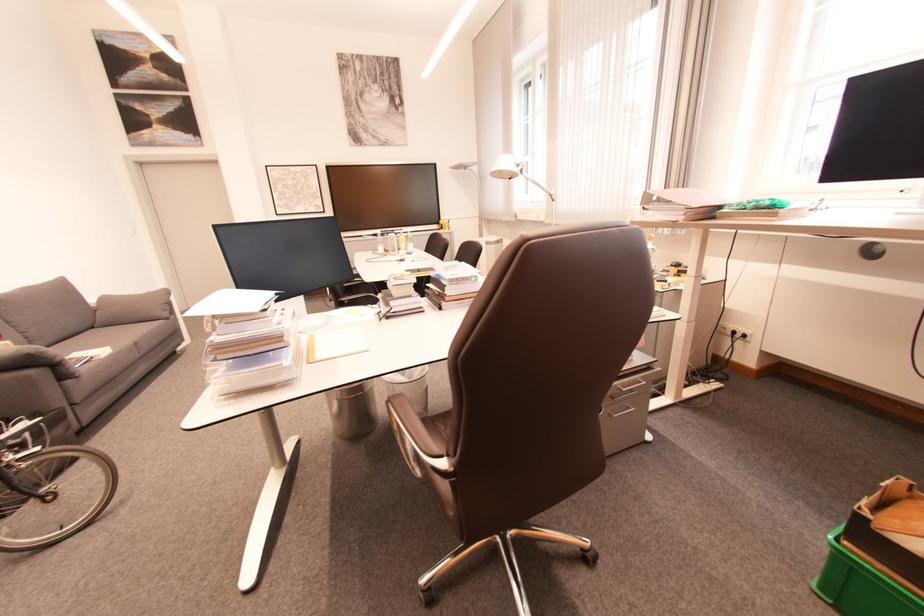
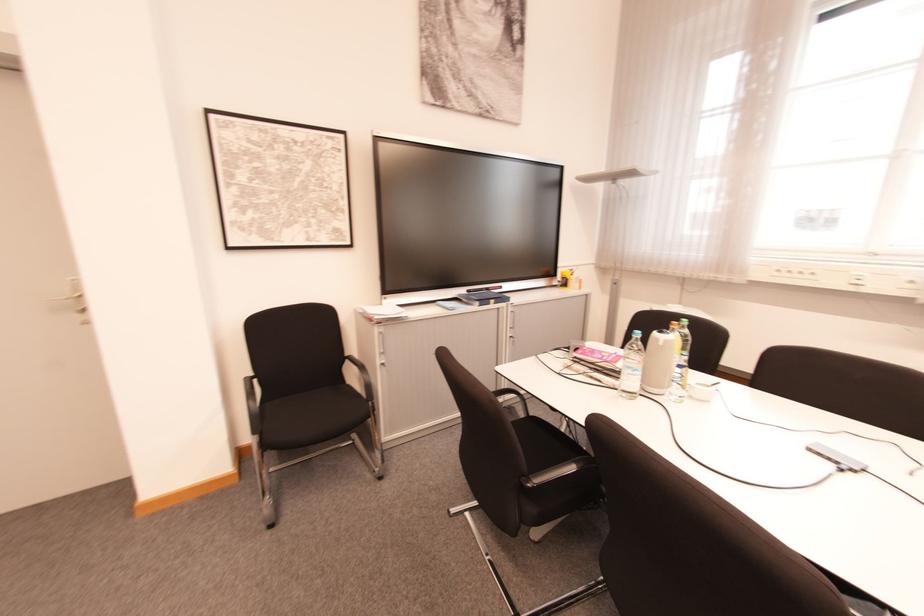
What movement of the cameraman would produce the second image?

The movement direction of the cameraman is left, forward.